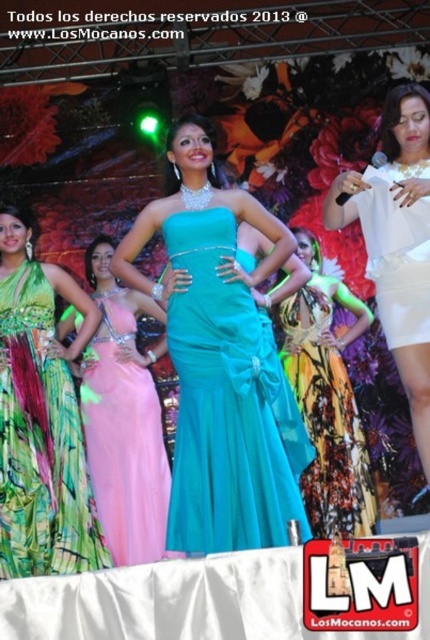
Which is more to the left, teal satin dress at center or white satin dress at right?

Positioned to the left is teal satin dress at center.

Is teal satin dress at center positioned at the back of white satin dress at right?

No, it is in front of white satin dress at right.

Between point (196, 461) and point (411, 164), which one is positioned in front?

Point (196, 461)

Locate an element on the screen. Image resolution: width=430 pixels, height=640 pixels. teal satin dress at center is located at coordinates (217, 356).

In the scene shown: Is printed silk dress at center closer to camera compared to white satin dress at right?

That is False.

Locate an element on the screen. The image size is (430, 640). printed silk dress at center is located at coordinates (328, 410).

This screenshot has height=640, width=430. What are the coordinates of `printed silk dress at center` in the screenshot? It's located at (328, 410).

Between point (279, 328) and point (331, 209), which one is positioned in front?

Point (331, 209) is in front.

Describe the element at coordinates (328, 410) in the screenshot. This screenshot has height=640, width=430. I see `printed silk dress at center` at that location.

What are the coordinates of `printed silk dress at center` in the screenshot? It's located at coord(328,410).